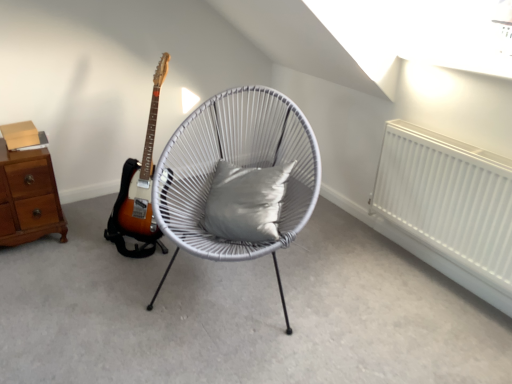
Locate an element on the screen. This screenshot has width=512, height=384. free space to the left of white woven chair at center is located at coordinates pos(73,291).